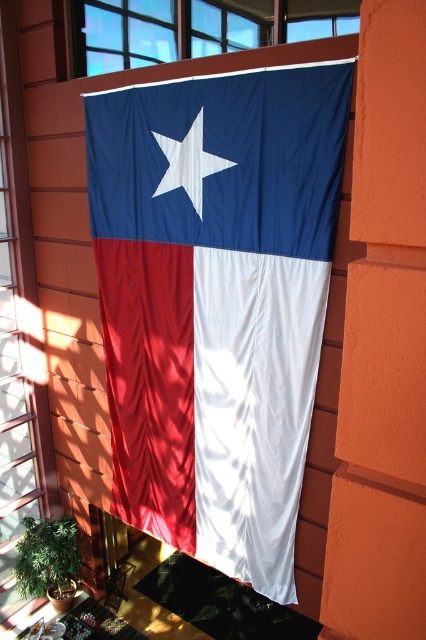
You are standing in a room with a large Texas state flag displayed on an orange wall. You notice a matte fabric flag at center and a transparent glass window at upper center. Which object is closer to the right side of the window?

The matte fabric flag at center is positioned on the right side of the transparent glass window at upper center, so it is closer to the right side of the window.

You are standing in front of the Texas state flag displayed on the orange wall. There are two points marked on the flag at coordinates point (330, 220) and point (414, 212). Which point is closer to you?

Point (414, 212) is closer to you because it is in front of point (330, 220).